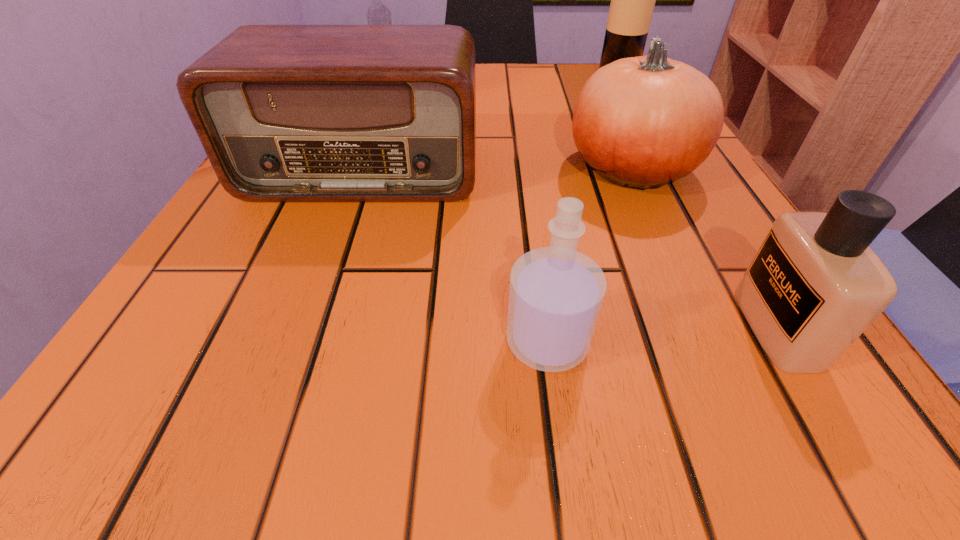
Where is `vacant space located on the left of the third object from left to right`? This screenshot has width=960, height=540. vacant space located on the left of the third object from left to right is located at coordinates (233, 341).

Image resolution: width=960 pixels, height=540 pixels. I want to click on vacant space located 0.130m on the front label of the right perfume, so click(635, 327).

The image size is (960, 540). Identify the location of free spot located on the front label of the right perfume. (706, 327).

Locate an element on the screen. blank space located on the front label of the right perfume is located at coordinates (599, 327).

The width and height of the screenshot is (960, 540). Identify the location of wine bottle that is positioned at the far edge. (632, 4).

You are a GUI agent. You are given a task and a screenshot of the screen. Output one action in this format:
    pyautogui.click(x=<x>, y=<y>)
    Task: Click on the vodka that is at the far edge
    
    Given the screenshot: What is the action you would take?
    pyautogui.click(x=377, y=14)

The image size is (960, 540). In order to click on vodka located at the left edge in this screenshot , I will do `click(377, 14)`.

The image size is (960, 540). In order to click on radio receiver that is at the left edge in this screenshot , I will do `click(285, 113)`.

Locate an element on the screen. wine bottle that is at the right edge is located at coordinates (632, 4).

Where is `pumpkin at the right edge`? This screenshot has width=960, height=540. pumpkin at the right edge is located at coordinates (642, 122).